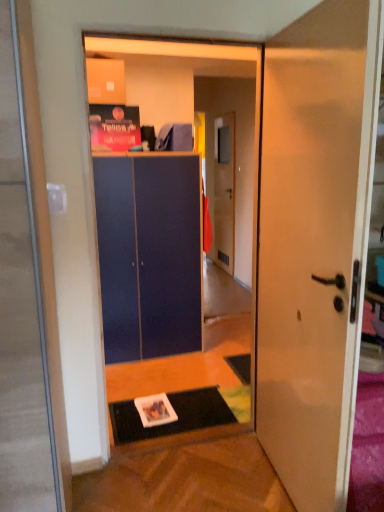
Question: Would you say blue matte cabinet at center contains white glossy door at center, the 2th door when ordered from back to front?

Choices:
 (A) no
 (B) yes

Answer: (A)

Question: Considering the relative positions of blue matte cabinet at center and white glossy door at center, the first door from the front, in the image provided, is blue matte cabinet at center behind white glossy door at center, the first door from the front,?

Choices:
 (A) yes
 (B) no

Answer: (A)

Question: From the image's perspective, is blue matte cabinet at center on top of white glossy door at center, the 2th door when ordered from back to front?

Choices:
 (A) yes
 (B) no

Answer: (A)

Question: Is blue matte cabinet at center with white glossy door at center, the first door from the front?

Choices:
 (A) no
 (B) yes

Answer: (A)

Question: From a real-world perspective, does blue matte cabinet at center stand above white glossy door at center, the 2th door when ordered from back to front?

Choices:
 (A) no
 (B) yes

Answer: (A)

Question: In the image, is white glossy door at center, the 2th door when ordered from back to front, positioned in front of or behind black rubber doormat at lower center?

Choices:
 (A) front
 (B) behind

Answer: (A)

Question: Considering the positions of point (266, 254) and point (185, 392), is point (266, 254) closer or farther from the camera than point (185, 392)?

Choices:
 (A) farther
 (B) closer

Answer: (B)

Question: From a real-world perspective, is white glossy door at center, the first door from the front, physically located above or below black rubber doormat at lower center?

Choices:
 (A) below
 (B) above

Answer: (B)

Question: From the image's perspective, is white glossy door at center, the 2th door when ordered from back to front, located above or below black rubber doormat at lower center?

Choices:
 (A) below
 (B) above

Answer: (B)

Question: From a real-world perspective, is matte blue cabinet at center above or below black rubber doormat at lower center?

Choices:
 (A) below
 (B) above

Answer: (B)

Question: Is matte blue cabinet at center inside or outside of black rubber doormat at lower center?

Choices:
 (A) outside
 (B) inside

Answer: (A)

Question: From the image's perspective, is matte blue cabinet at center located above or below black rubber doormat at lower center?

Choices:
 (A) above
 (B) below

Answer: (A)

Question: Is matte blue cabinet at center bigger or smaller than black rubber doormat at lower center?

Choices:
 (A) small
 (B) big

Answer: (B)

Question: Is black rubber doormat at lower center inside the boundaries of matte blue cabinet at center, or outside?

Choices:
 (A) inside
 (B) outside

Answer: (B)

Question: Does point (220, 395) appear closer or farther from the camera than point (162, 348)?

Choices:
 (A) farther
 (B) closer

Answer: (B)